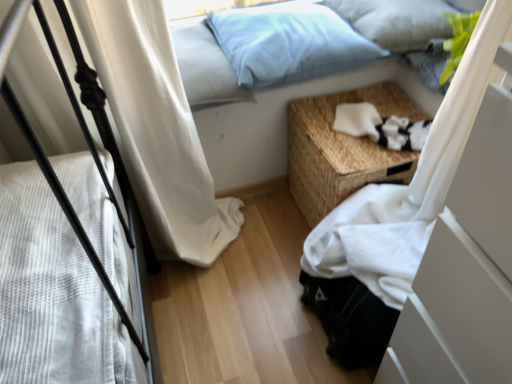
Question: Is light blue fabric pillow at upper center, which is the first pillow from left to right, not within white fabric at lower right?

Choices:
 (A) yes
 (B) no

Answer: (A)

Question: From a real-world perspective, is light blue fabric pillow at upper center, marked as the third pillow in a right-to-left arrangement, positioned over white fabric at lower right based on gravity?

Choices:
 (A) no
 (B) yes

Answer: (B)

Question: From a real-world perspective, is light blue fabric pillow at upper center, marked as the third pillow in a right-to-left arrangement, positioned under white fabric at lower right based on gravity?

Choices:
 (A) yes
 (B) no

Answer: (B)

Question: Is light blue fabric pillow at upper center, marked as the third pillow in a right-to-left arrangement, bigger than white fabric at lower right?

Choices:
 (A) yes
 (B) no

Answer: (B)

Question: Is white fabric at lower right at the back of light blue fabric pillow at upper center, marked as the third pillow in a right-to-left arrangement?

Choices:
 (A) no
 (B) yes

Answer: (A)

Question: Is light blue fabric pillow at upper center, which is the first pillow from left to right, far from white fabric at lower right?

Choices:
 (A) no
 (B) yes

Answer: (A)

Question: Can you confirm if light blue fabric pillow at upper center, placed as the second pillow when sorted from right to left, is positioned to the right of white soft fabric at lower right?

Choices:
 (A) yes
 (B) no

Answer: (B)

Question: Is light blue fabric pillow at upper center, placed as the second pillow when sorted from right to left, not inside white soft fabric at lower right?

Choices:
 (A) no
 (B) yes

Answer: (B)

Question: From a real-world perspective, does light blue fabric pillow at upper center, placed as the second pillow when sorted from right to left, stand above white soft fabric at lower right?

Choices:
 (A) no
 (B) yes

Answer: (B)

Question: Is light blue fabric pillow at upper center, placed as the second pillow when sorted from right to left, wider than white soft fabric at lower right?

Choices:
 (A) yes
 (B) no

Answer: (A)

Question: From the image's perspective, would you say light blue fabric pillow at upper center, placed as the second pillow when sorted from right to left, is positioned over white soft fabric at lower right?

Choices:
 (A) no
 (B) yes

Answer: (B)

Question: From a real-world perspective, is light blue fabric pillow at upper center, placed as the second pillow when sorted from right to left, positioned under white soft fabric at lower right based on gravity?

Choices:
 (A) yes
 (B) no

Answer: (B)

Question: Is light blue fabric pillow at upper center, the third pillow in the left-to-right sequence, thinner than white soft fabric at lower right?

Choices:
 (A) no
 (B) yes

Answer: (A)